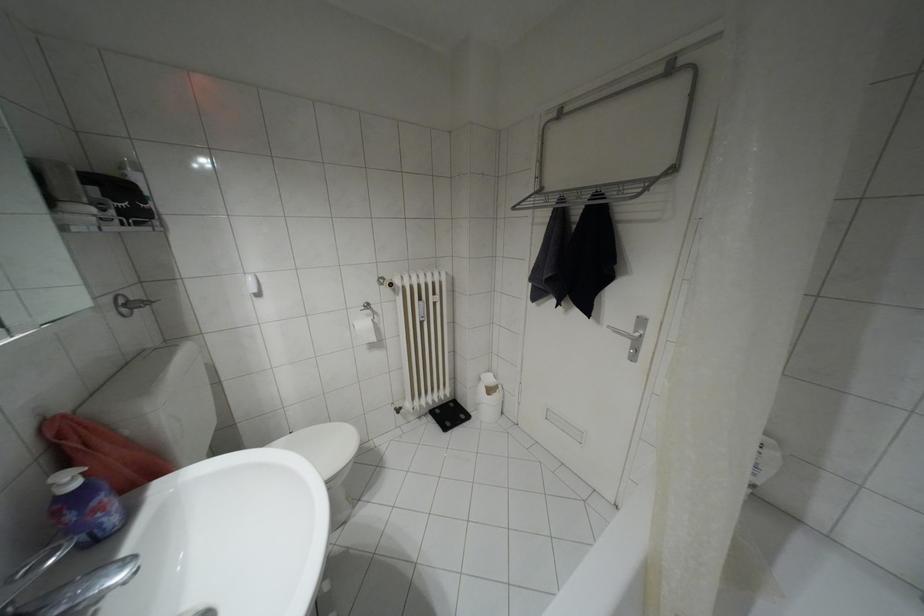
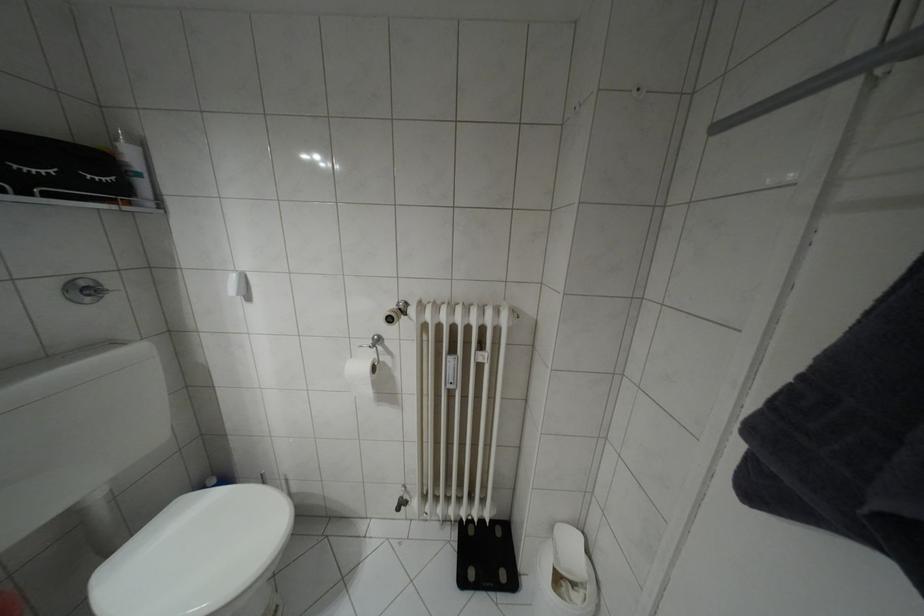
In the second image, find the point that corresponds to (123,168) in the first image.

(116, 139)